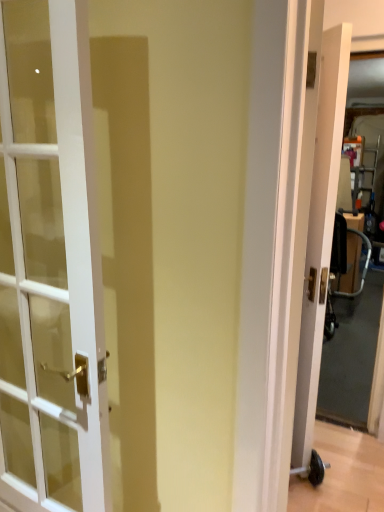
Question: Can you confirm if white wood door at right, acting as the 1th door starting from the right, is shorter than white glass door at left, which appears as the 1th door when viewed from the front?

Choices:
 (A) yes
 (B) no

Answer: (B)

Question: Can we say white wood door at right, the 2th door from the left, lies outside white glass door at left, placed as the 1th door when sorted from left to right?

Choices:
 (A) yes
 (B) no

Answer: (A)

Question: Does white wood door at right, which ranks as the second door in front-to-back order, lie in front of white glass door at left, placed as the 1th door when sorted from left to right?

Choices:
 (A) no
 (B) yes

Answer: (A)

Question: From a real-world perspective, is white wood door at right, which ranks as the second door in front-to-back order, physically below white glass door at left, which appears as the second door when viewed from the back?

Choices:
 (A) no
 (B) yes

Answer: (B)

Question: Is white glass door at left, placed as the 1th door when sorted from left to right, located within white wood door at right, acting as the 1th door starting from the right?

Choices:
 (A) no
 (B) yes

Answer: (A)

Question: From the image's perspective, does white wood door at right, the 2th door from the left, appear higher than white glass door at left, which is the 2th door from right to left?

Choices:
 (A) yes
 (B) no

Answer: (A)

Question: Is the surface of metallic silver baby carriage at right in direct contact with white glass door at left, which appears as the second door when viewed from the back?

Choices:
 (A) yes
 (B) no

Answer: (B)

Question: Does metallic silver baby carriage at right have a lesser height compared to white glass door at left, placed as the 1th door when sorted from left to right?

Choices:
 (A) yes
 (B) no

Answer: (A)

Question: Is the position of metallic silver baby carriage at right more distant than that of white glass door at left, which appears as the 1th door when viewed from the front?

Choices:
 (A) no
 (B) yes

Answer: (B)

Question: From a real-world perspective, is metallic silver baby carriage at right physically above white glass door at left, placed as the 1th door when sorted from left to right?

Choices:
 (A) yes
 (B) no

Answer: (B)

Question: Is there a large distance between metallic silver baby carriage at right and white glass door at left, which appears as the 1th door when viewed from the front?

Choices:
 (A) yes
 (B) no

Answer: (A)

Question: From a real-world perspective, is metallic silver baby carriage at right positioned under white glass door at left, which is the 2th door from right to left, based on gravity?

Choices:
 (A) no
 (B) yes

Answer: (B)

Question: Does white wood door at right, which ranks as the second door in front-to-back order, have a greater height compared to metallic silver baby carriage at right?

Choices:
 (A) no
 (B) yes

Answer: (B)